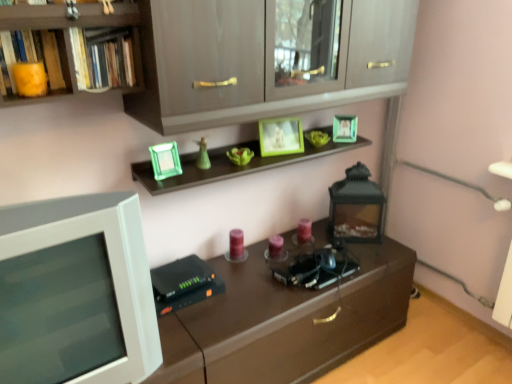
Question: Does matte yellow book at upper left, the second book viewed from the right, appear on the right side of matte gray cabinet at upper center?

Choices:
 (A) no
 (B) yes

Answer: (A)

Question: Is matte yellow book at upper left, the second book viewed from the right, next to matte gray cabinet at upper center?

Choices:
 (A) no
 (B) yes

Answer: (A)

Question: Is matte yellow book at upper left, the second book viewed from the right, thinner than matte gray cabinet at upper center?

Choices:
 (A) yes
 (B) no

Answer: (A)

Question: Can you confirm if matte yellow book at upper left, placed as the 1th book when sorted from left to right, is smaller than matte gray cabinet at upper center?

Choices:
 (A) yes
 (B) no

Answer: (A)

Question: Is matte yellow book at upper left, the second book viewed from the right, at the left side of matte gray cabinet at upper center?

Choices:
 (A) no
 (B) yes

Answer: (B)

Question: In the image, is matte yellow book at upper left, the second book viewed from the right, positioned in front of or behind white plastic computer monitor at left?

Choices:
 (A) behind
 (B) front

Answer: (A)

Question: In terms of height, does matte yellow book at upper left, placed as the 1th book when sorted from left to right, look taller or shorter compared to white plastic computer monitor at left?

Choices:
 (A) tall
 (B) short

Answer: (B)

Question: In terms of size, does matte yellow book at upper left, the second book viewed from the right, appear bigger or smaller than white plastic computer monitor at left?

Choices:
 (A) small
 (B) big

Answer: (A)

Question: Which is correct: matte yellow book at upper left, placed as the 1th book when sorted from left to right, is inside white plastic computer monitor at left, or outside of it?

Choices:
 (A) inside
 (B) outside

Answer: (B)

Question: Looking at the image, does matte yellow book at upper left, the second book viewed from the right, seem bigger or smaller compared to black matte lantern at center-right?

Choices:
 (A) big
 (B) small

Answer: (B)

Question: Is matte yellow book at upper left, placed as the 1th book when sorted from left to right, to the left or to the right of black matte lantern at center-right in the image?

Choices:
 (A) right
 (B) left

Answer: (B)

Question: From the image's perspective, is matte yellow book at upper left, the second book viewed from the right, above or below black matte lantern at center-right?

Choices:
 (A) above
 (B) below

Answer: (A)

Question: Is matte yellow book at upper left, placed as the 1th book when sorted from left to right, situated inside black matte lantern at center-right or outside?

Choices:
 (A) inside
 (B) outside

Answer: (B)

Question: Is matte yellow book at upper left, placed as the 1th book when sorted from left to right, bigger or smaller than hardcover books at upper left, which is the 1th book from right to left?

Choices:
 (A) small
 (B) big

Answer: (A)

Question: Visually, is matte yellow book at upper left, placed as the 1th book when sorted from left to right, positioned to the left or to the right of hardcover books at upper left, which is the 1th book from right to left?

Choices:
 (A) left
 (B) right

Answer: (A)